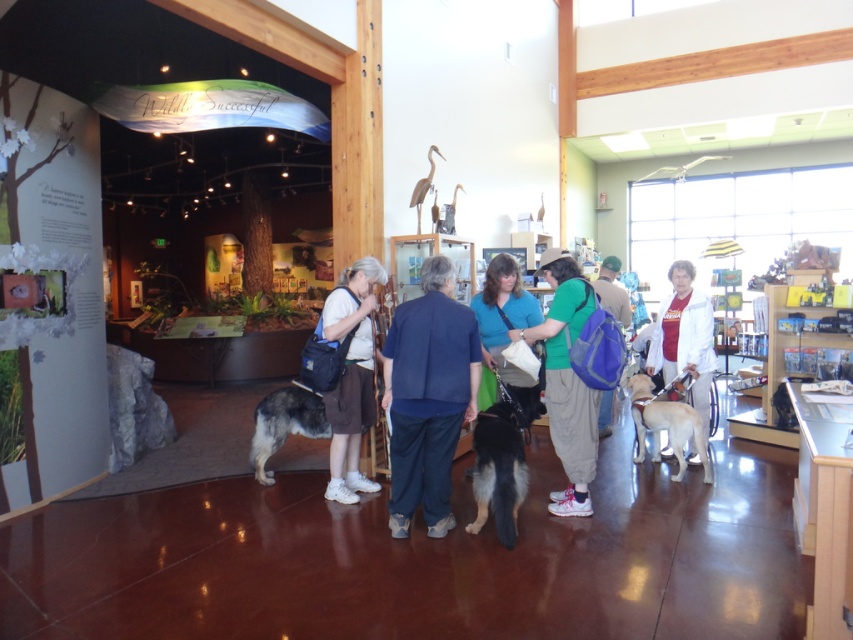
Question: Considering the real-world distances, which object is farthest from the white matte jacket at center?

Choices:
 (A) gray woolen dog at center
 (B) black fur dog at center
 (C) green fabric backpack at center
 (D) blue fabric backpack at center

Answer: (A)

Question: Does white matte jacket at center have a smaller size compared to light brown fur at center?

Choices:
 (A) no
 (B) yes

Answer: (A)

Question: Which point is closer to the camera?

Choices:
 (A) (695, 349)
 (B) (321, 321)

Answer: (B)

Question: Which object is positioned farthest from the blue fabric shirt at center?

Choices:
 (A) gray woolen dog at center
 (B) green fabric backpack at center
 (C) blue fabric backpack at center

Answer: (C)

Question: Is white matte jacket at center smaller than blue fabric shirt at center?

Choices:
 (A) no
 (B) yes

Answer: (A)

Question: Does green fabric backpack at center appear over white matte jacket at center?

Choices:
 (A) yes
 (B) no

Answer: (B)